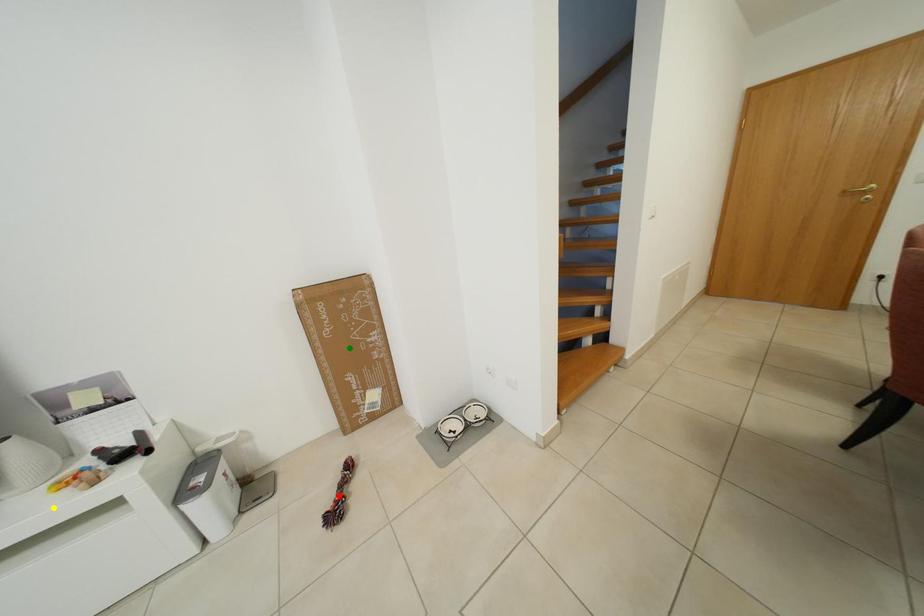
Order these from nearest to farthest:
1. green point
2. red point
3. yellow point

yellow point, red point, green point